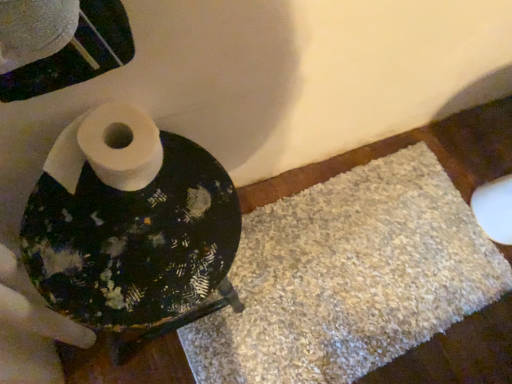
Question: From the image's perspective, is white shaggy bath mat at lower right under white matte toilet paper at center?

Choices:
 (A) no
 (B) yes

Answer: (B)

Question: From the image's perspective, does white shaggy bath mat at lower right appear higher than white matte toilet paper at center?

Choices:
 (A) no
 (B) yes

Answer: (A)

Question: Can you confirm if white shaggy bath mat at lower right is smaller than white matte toilet paper at center?

Choices:
 (A) no
 (B) yes

Answer: (A)

Question: From a real-world perspective, is white shaggy bath mat at lower right below white matte toilet paper at center?

Choices:
 (A) yes
 (B) no

Answer: (A)

Question: Is white shaggy bath mat at lower right facing away from white matte toilet paper at center?

Choices:
 (A) yes
 (B) no

Answer: (B)

Question: Can you confirm if white shaggy bath mat at lower right is shorter than white matte toilet paper at center?

Choices:
 (A) no
 (B) yes

Answer: (B)

Question: From the image's perspective, would you say white matte toilet paper at center is positioned over white shaggy bath mat at lower right?

Choices:
 (A) yes
 (B) no

Answer: (A)

Question: Does white matte toilet paper at center turn towards white shaggy bath mat at lower right?

Choices:
 (A) no
 (B) yes

Answer: (A)

Question: Is white matte toilet paper at center far from white shaggy bath mat at lower right?

Choices:
 (A) yes
 (B) no

Answer: (B)

Question: From a real-world perspective, is white matte toilet paper at center physically below white shaggy bath mat at lower right?

Choices:
 (A) yes
 (B) no

Answer: (B)

Question: Is white matte toilet paper at center looking in the opposite direction of white shaggy bath mat at lower right?

Choices:
 (A) no
 (B) yes

Answer: (A)

Question: Is white matte toilet paper at center smaller than white shaggy bath mat at lower right?

Choices:
 (A) yes
 (B) no

Answer: (A)

Question: Does point (445, 208) appear closer or farther from the camera than point (56, 173)?

Choices:
 (A) closer
 (B) farther

Answer: (B)